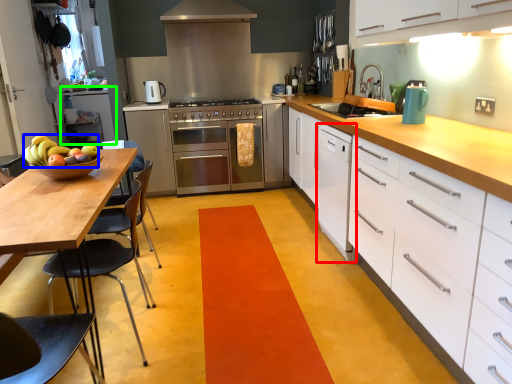
Question: Considering the real-world distances, which object is closest to file cabinet (highlighted by a red box)? fruit (highlighted by a blue box) or cabinetry (highlighted by a green box).

Choices:
 (A) fruit
 (B) cabinetry

Answer: (A)